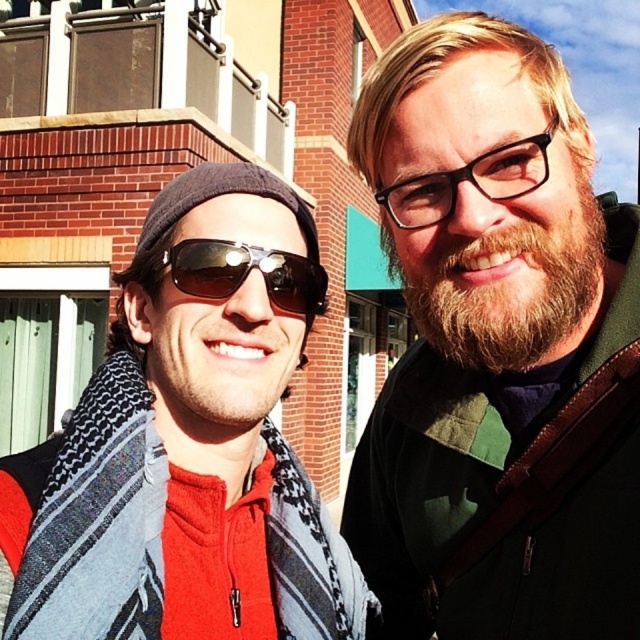
Question: Among these objects, which one is farthest from the camera?

Choices:
 (A) bearded man at center
 (B) gray woven scarf at left
 (C) sunglasses at center
 (D) brown fuzzy beard at right

Answer: (D)

Question: Is gray woven scarf at left to the left of brown fuzzy beard at right from the viewer's perspective?

Choices:
 (A) no
 (B) yes

Answer: (B)

Question: Considering the relative positions of bearded man at center and sunglasses at center in the image provided, where is bearded man at center located with respect to sunglasses at center?

Choices:
 (A) below
 (B) above

Answer: (A)

Question: Which point is closer to the camera?

Choices:
 (A) bearded man at center
 (B) brown fuzzy beard at right

Answer: (A)

Question: Does gray woven scarf at left appear on the right side of brown fuzzy beard at right?

Choices:
 (A) yes
 (B) no

Answer: (B)

Question: Which of these objects is positioned closest to the bearded man at center?

Choices:
 (A) brown fuzzy beard at right
 (B) sunglasses at center

Answer: (A)